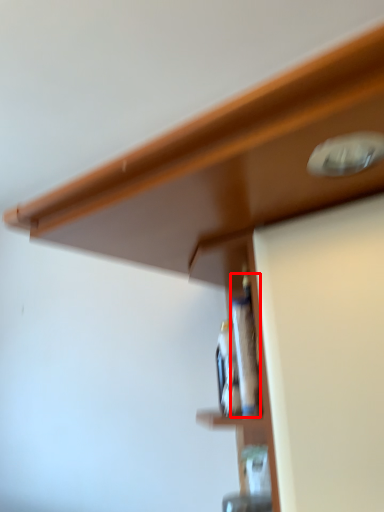
Question: Where is bottle (annotated by the red box) located in relation to bottle in the image?

Choices:
 (A) left
 (B) right

Answer: (A)